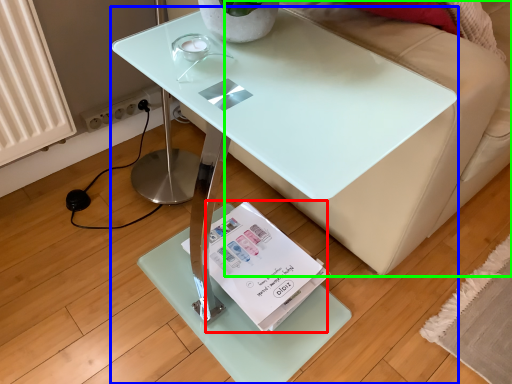
Question: Considering the real-world distances, which object is closest to magazine (highlighted by a red box)? table (highlighted by a blue box) or couch (highlighted by a green box).

Choices:
 (A) table
 (B) couch

Answer: (A)